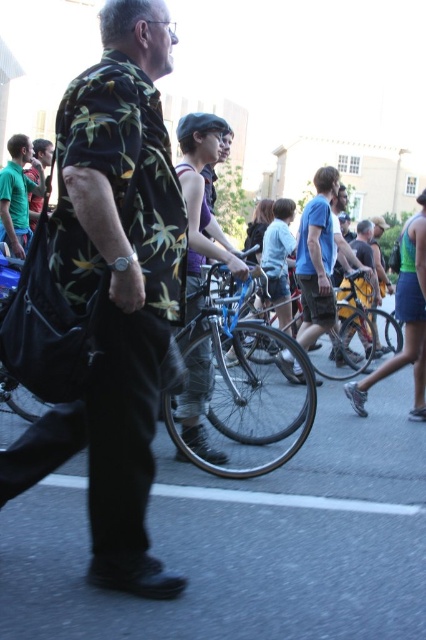
Question: Which point is farther from the camera taking this photo?

Choices:
 (A) (192, 406)
 (B) (198, 298)
 (C) (357, 289)

Answer: (C)

Question: Is the position of printed fabric shirt at center more distant than that of shiny blue bicycle at center?

Choices:
 (A) yes
 (B) no

Answer: (B)

Question: Which of the following is the farthest from the observer?

Choices:
 (A) shiny metallic bicycle at center
 (B) blue cotton t-shirt at center
 (C) blue metallic bicycle at center

Answer: (A)

Question: Can you confirm if shiny blue bicycle at center is positioned below shiny metallic bicycle at center?

Choices:
 (A) yes
 (B) no

Answer: (A)

Question: Is blue metallic bicycle at center to the left of matte purple tank top at center from the viewer's perspective?

Choices:
 (A) no
 (B) yes

Answer: (A)

Question: Estimate the real-world distances between objects in this image. Which object is closer to the printed fabric shirt at center?

Choices:
 (A) blue metallic bicycle at center
 (B) blue cotton t-shirt at center
 (C) green t-shirt at left

Answer: (A)